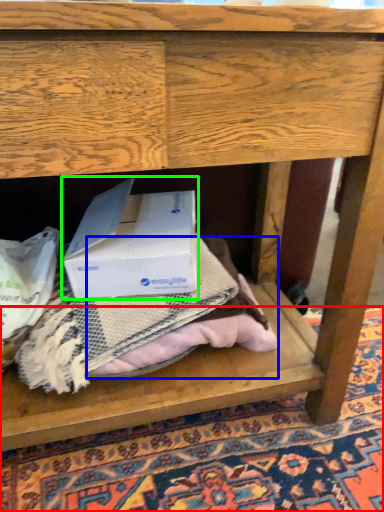
Question: Which object is positioned farthest from mat (highlighted by a red box)? Select from clothing (highlighted by a blue box) and box (highlighted by a green box).

Choices:
 (A) clothing
 (B) box

Answer: (B)